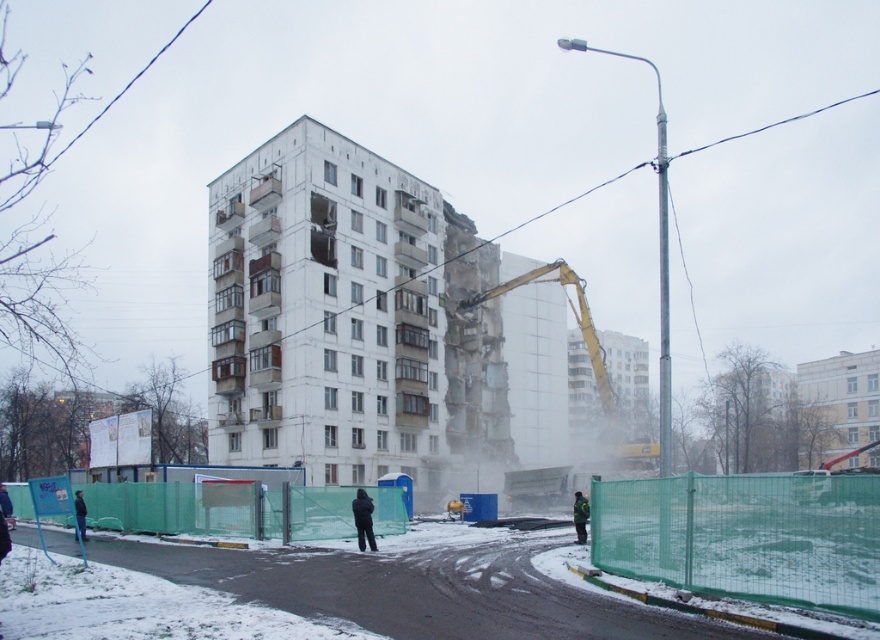
Which is above, black matte jacket at center or green reflective jacket at center?

black matte jacket at center

Does black matte jacket at center have a lesser width compared to green reflective jacket at center?

Correct, black matte jacket at center's width is less than green reflective jacket at center's.

Is point (372, 545) in front of point (581, 532)?

Yes.

Find the location of a particular element. This screenshot has width=880, height=640. black matte jacket at center is located at coordinates (363, 518).

Is green mesh fence at lower center smaller than black jacket at lower left?

No.

Describe the element at coordinates (419, 586) in the screenshot. I see `green mesh fence at lower center` at that location.

At what (x,y) coordinates should I click in order to perform the action: click on green mesh fence at lower center. Please return your answer as a coordinate pair (x, y). The height and width of the screenshot is (640, 880). Looking at the image, I should click on (419, 586).

At what (x,y) coordinates should I click in order to perform the action: click on green mesh fence at lower center. Please return your answer as a coordinate pair (x, y). Looking at the image, I should click on (419, 586).

Which of these two, green mesh fence at lower center or black matte jacket at center, stands shorter?

black matte jacket at center is shorter.

Which is more to the left, green mesh fence at lower center or black matte jacket at center?

Positioned to the left is green mesh fence at lower center.

Where is `green mesh fence at lower center`? This screenshot has height=640, width=880. green mesh fence at lower center is located at coordinates (419, 586).